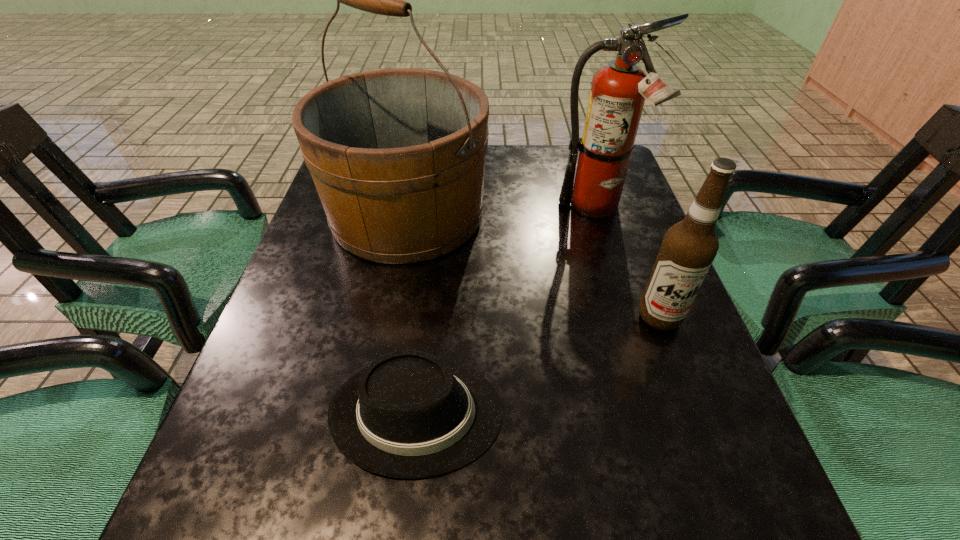
Locate an element on the screen. bucket present at the far edge is located at coordinates (397, 156).

Where is `fire extinguisher located in the far edge section of the desktop`? The width and height of the screenshot is (960, 540). fire extinguisher located in the far edge section of the desktop is located at coordinates (618, 91).

This screenshot has height=540, width=960. What are the coordinates of `bucket that is at the left edge` in the screenshot? It's located at (397, 156).

You are a GUI agent. You are given a task and a screenshot of the screen. Output one action in this format:
    pyautogui.click(x=<x>, y=<y>)
    Task: Click on the fedora present at the left edge
    
    Given the screenshot: What is the action you would take?
    pyautogui.click(x=408, y=415)

Identify the location of fire extinguisher that is at the right edge. (618, 91).

Identify the location of alcohol that is at the right edge. (689, 247).

Identify the location of object that is at the far left corner. The image size is (960, 540). (397, 156).

Where is `object present at the far right corner`? The image size is (960, 540). object present at the far right corner is located at coordinates (618, 91).

Find the location of a particular element. This screenshot has width=960, height=540. free space at the near edge of the desktop is located at coordinates (355, 500).

Where is `free region at the left edge of the desktop`? The image size is (960, 540). free region at the left edge of the desktop is located at coordinates (345, 260).